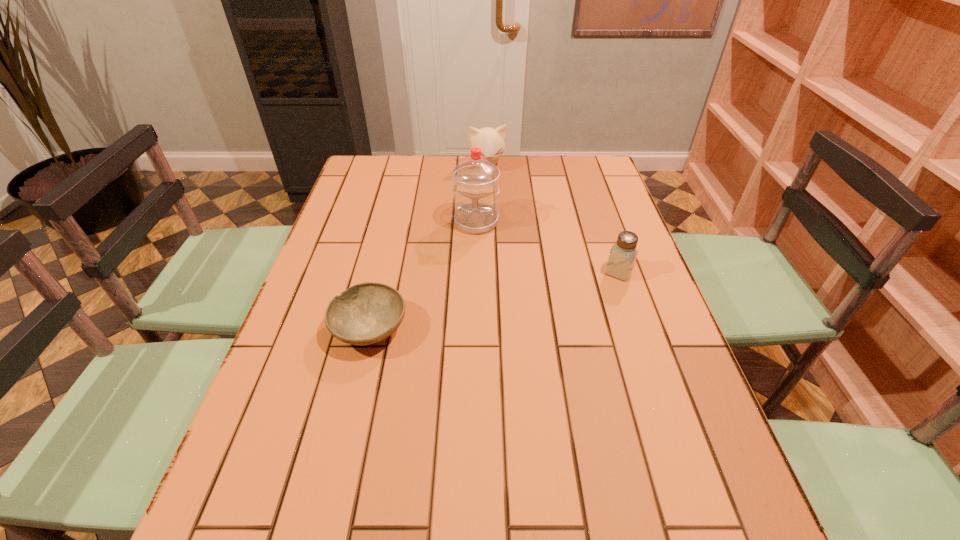
Locate an element on the screen. The width and height of the screenshot is (960, 540). vacant region located 0.110m on the face of the kitten is located at coordinates (495, 192).

The image size is (960, 540). I want to click on vacant space located 0.090m on the face of the kitten, so click(494, 188).

I want to click on free region located 0.170m on the face of the kitten, so click(x=498, y=202).

Find the location of a particular element. The height and width of the screenshot is (540, 960). free spot located on the handle side of the tallest object is located at coordinates click(473, 258).

Image resolution: width=960 pixels, height=540 pixels. I want to click on vacant area situated 0.400m on the handle side of the tallest object, so click(x=466, y=343).

The image size is (960, 540). I want to click on free space located 0.210m on the handle side of the tallest object, so click(x=470, y=285).

This screenshot has width=960, height=540. I want to click on object that is at the far edge, so click(x=491, y=141).

What are the coordinates of `object at the left edge` in the screenshot? It's located at (366, 313).

Identify the location of object situated at the right edge. This screenshot has height=540, width=960. (623, 254).

Where is `free location at the far edge`? Image resolution: width=960 pixels, height=540 pixels. free location at the far edge is located at coordinates (463, 158).